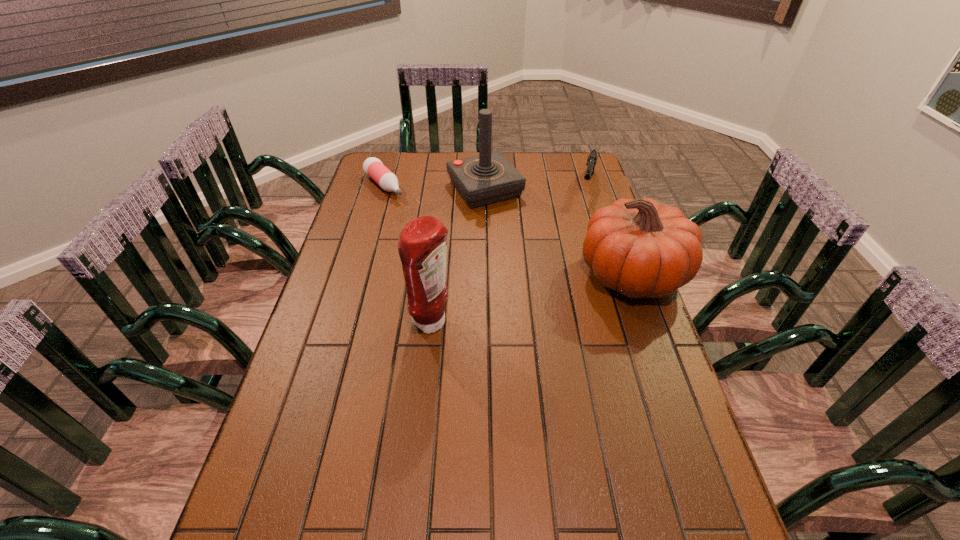
I want to click on vacant space that's between the shortest object and the third tallest object, so click(508, 230).

Where is `free space that is in between the condiment and the fourth tallest object`? free space that is in between the condiment and the fourth tallest object is located at coordinates (510, 254).

Find the location of a particular element. The height and width of the screenshot is (540, 960). free area in between the second shortest object and the condiment is located at coordinates (510, 254).

Find the location of a particular element. free space between the condiment and the fourth tallest object is located at coordinates (510, 254).

I want to click on unoccupied position between the bottle and the third shortest object, so coord(508,230).

The image size is (960, 540). What are the coordinates of `free space between the joystick and the gun` in the screenshot? It's located at (536, 187).

Where is `blank region between the joystick and the condiment`? This screenshot has height=540, width=960. blank region between the joystick and the condiment is located at coordinates (459, 256).

The height and width of the screenshot is (540, 960). Find the location of `free space between the fourth tallest object and the joystick`. free space between the fourth tallest object and the joystick is located at coordinates (536, 187).

Identify the location of object that is the second nearest to the joystick. Image resolution: width=960 pixels, height=540 pixels. (592, 158).

Find the location of a particular element. The image size is (960, 540). object that ranks as the second closest to the shortest object is located at coordinates (422, 245).